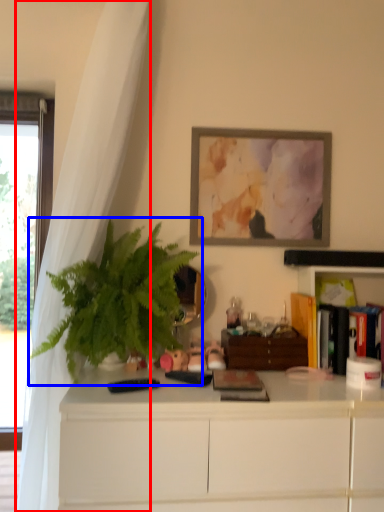
Question: Which of the following is the farthest to the observer, curtain (highlighted by a red box) or houseplant (highlighted by a blue box)?

Choices:
 (A) curtain
 (B) houseplant

Answer: (B)